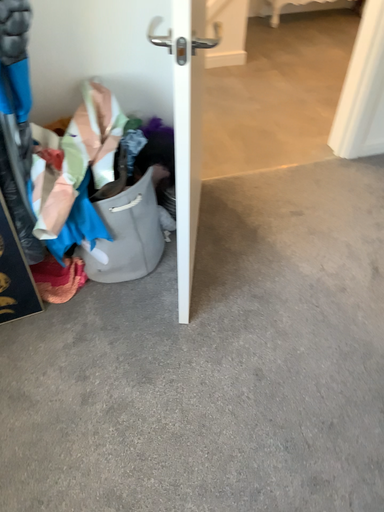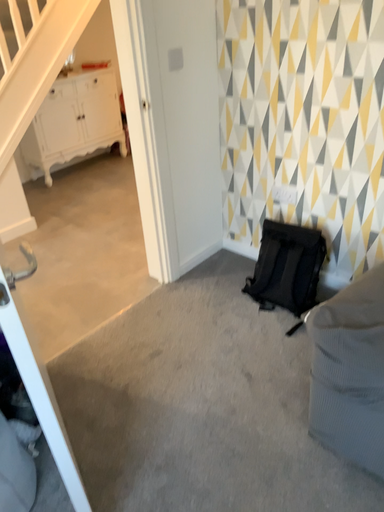
Question: Which way did the camera rotate in the video?

Choices:
 (A) rotated left
 (B) rotated right

Answer: (B)